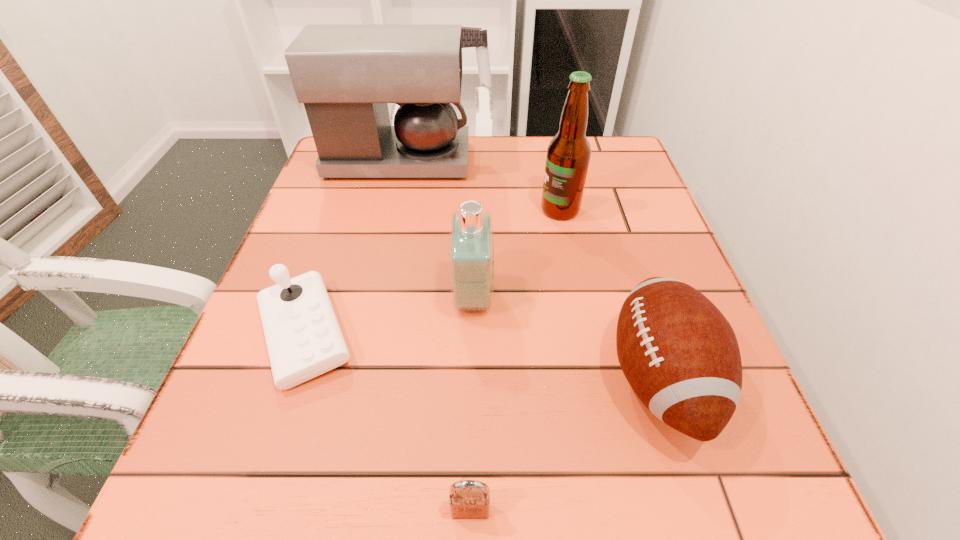
Image resolution: width=960 pixels, height=540 pixels. I want to click on empty location between the fourth shortest object and the joystick, so click(389, 315).

The width and height of the screenshot is (960, 540). In order to click on free point between the padlock and the joystick in this screenshot , I will do `click(388, 422)`.

In order to click on free space between the football and the perfume in this screenshot , I will do `click(565, 338)`.

At what (x,y) coordinates should I click in order to perform the action: click on free spot between the nearest object and the farthest object. Please return your answer as a coordinate pair (x, y). This screenshot has height=540, width=960. Looking at the image, I should click on (434, 336).

At what (x,y) coordinates should I click in order to perform the action: click on unoccupied area between the perfume and the padlock. Please return your answer as a coordinate pair (x, y). Image resolution: width=960 pixels, height=540 pixels. Looking at the image, I should click on (471, 404).

At what (x,y) coordinates should I click in order to perform the action: click on free space between the football and the joystick. Please return your answer as a coordinate pair (x, y). Image resolution: width=960 pixels, height=540 pixels. Looking at the image, I should click on (482, 356).

Where is `vacant space that's between the padlock and the third shortest object`? The image size is (960, 540). vacant space that's between the padlock and the third shortest object is located at coordinates (564, 445).

Find the location of a particular element. This screenshot has height=540, width=960. vacant space in between the joystick and the beer bottle is located at coordinates (432, 272).

Find the location of a particular element. This screenshot has height=540, width=960. free space between the joystick and the third shortest object is located at coordinates (482, 356).

The width and height of the screenshot is (960, 540). In order to click on unoccupied position between the farthest object and the nearest object in this screenshot , I will do `click(434, 336)`.